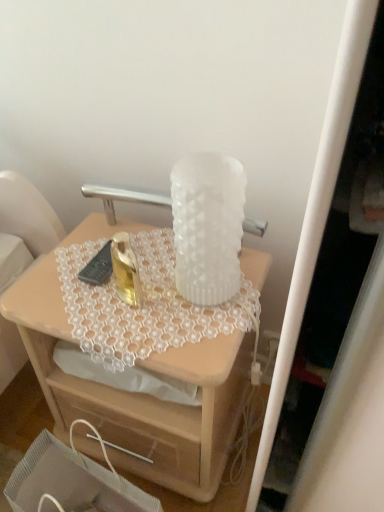
Find the location of a particular element. The width and height of the screenshot is (384, 512). free space above translucent glass vase at upper center (from a real-world perspective) is located at coordinates (135, 281).